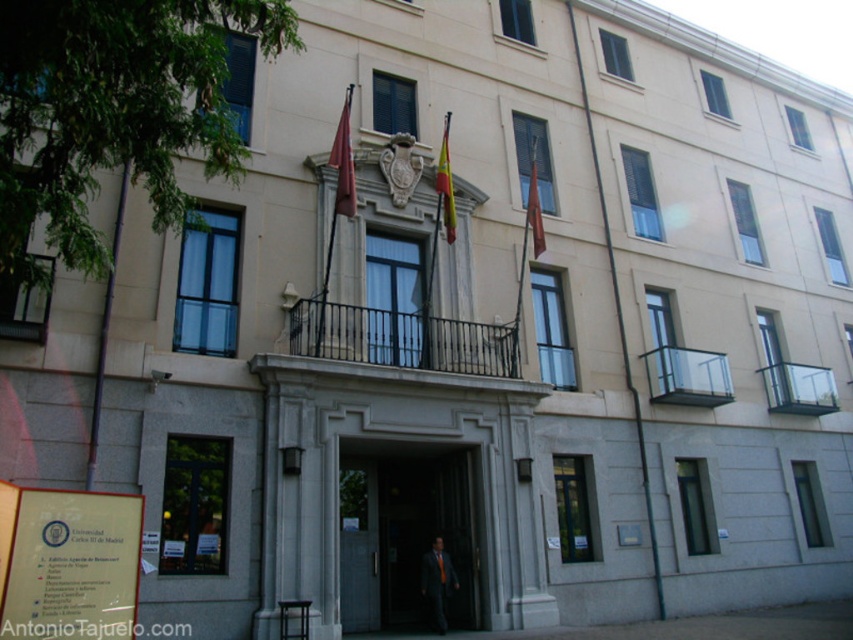
Question: Based on their relative distances, which object is farther from the yellow fabric flag at center?

Choices:
 (A) matte black suit at center
 (B) matte red flag at upper center

Answer: (A)

Question: Does matte red flag at upper center appear on the right side of yellow fabric flag at center?

Choices:
 (A) yes
 (B) no

Answer: (B)

Question: Which point is farther to the camera?

Choices:
 (A) matte black suit at center
 (B) red fabric flag at upper center

Answer: (B)

Question: Which point is farther to the camera?

Choices:
 (A) (448, 584)
 (B) (335, 188)

Answer: (B)

Question: Is the position of matte black suit at center less distant than that of red fabric flag at upper center?

Choices:
 (A) no
 (B) yes

Answer: (B)

Question: Is matte red flag at upper center positioned in front of yellow fabric flag at center?

Choices:
 (A) no
 (B) yes

Answer: (B)